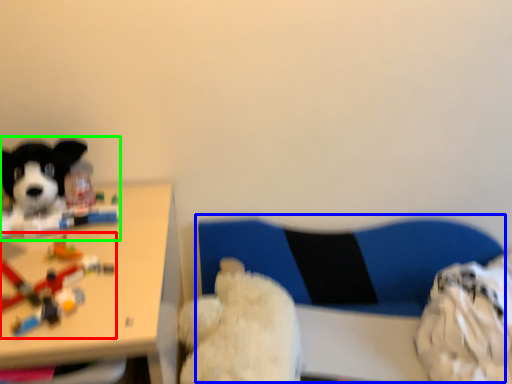
Question: Which is nearer to the toy (highlighted by a red box)? swivel chair (highlighted by a blue box) or dog (highlighted by a green box).

Choices:
 (A) swivel chair
 (B) dog

Answer: (B)